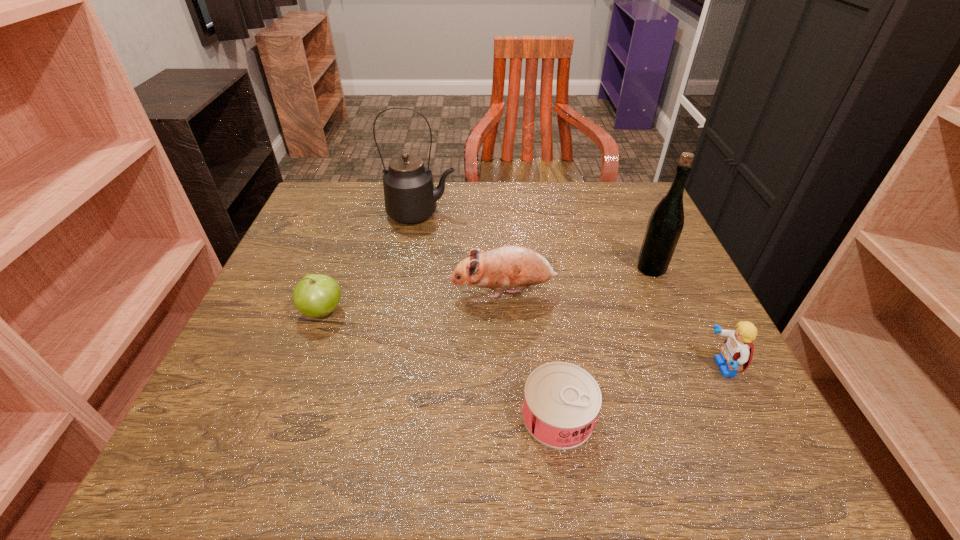
Find the location of a particular element. This screenshot has height=540, width=960. free space located 0.120m at the face of the hamster is located at coordinates (395, 291).

At what (x,y) coordinates should I click in order to perform the action: click on vacant position located 0.400m at the face of the hamster. Please return your answer as a coordinate pair (x, y). Looking at the image, I should click on (263, 291).

The height and width of the screenshot is (540, 960). In order to click on blank area located on the front-facing side of the Lego in this screenshot , I will do `click(622, 367)`.

The image size is (960, 540). I want to click on vacant space situated on the front-facing side of the Lego, so click(483, 367).

Identify the location of free space located on the front-facing side of the Lego. (588, 367).

The width and height of the screenshot is (960, 540). I want to click on free space located 0.260m on the right of the apple, so click(x=474, y=312).

Where is `vacant space located on the right of the shortest object`? This screenshot has height=540, width=960. vacant space located on the right of the shortest object is located at coordinates (649, 415).

Locate an element on the screen. This screenshot has width=960, height=540. object positioned at the far edge is located at coordinates (410, 196).

Where is `object located in the near edge section of the desktop`? object located in the near edge section of the desktop is located at coordinates (561, 403).

The width and height of the screenshot is (960, 540). Find the location of `object situated at the left edge`. object situated at the left edge is located at coordinates (316, 295).